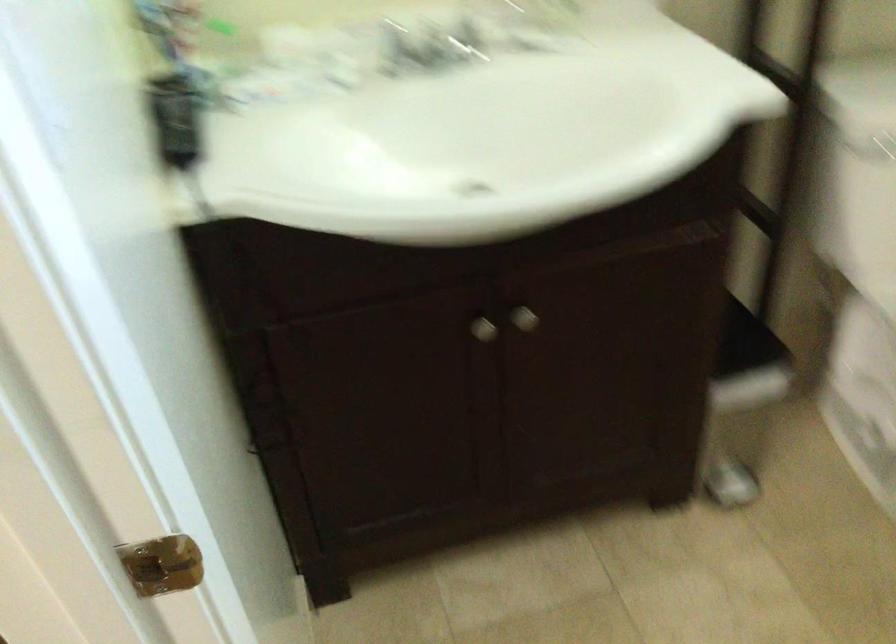
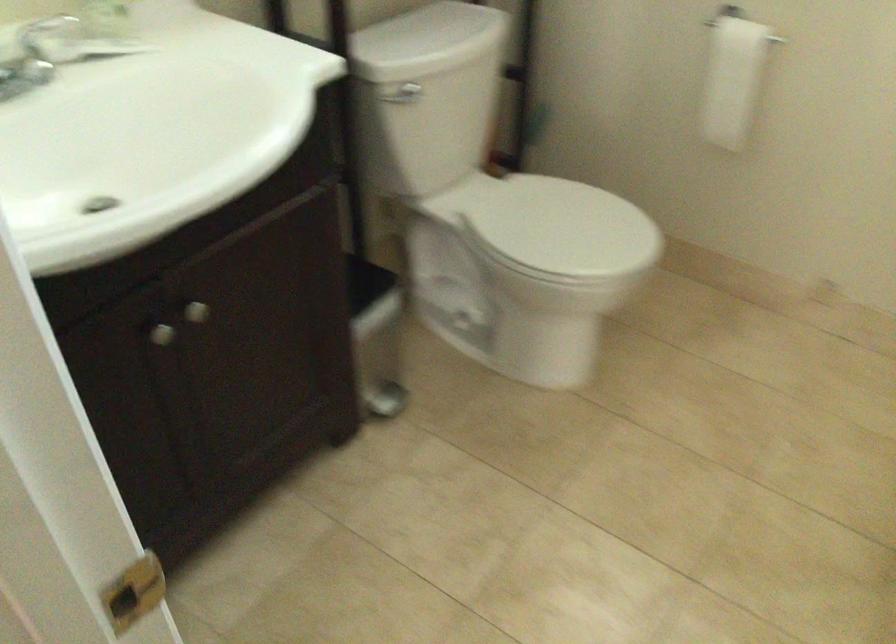
In the second image, find the point that corresponds to the point at 477,324 in the first image.

(161, 334)